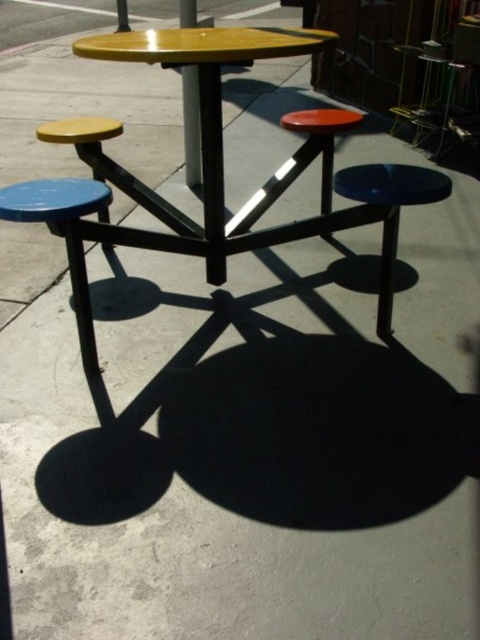
You are a person who is 1.6 meters tall and want to sit comfortably on either the blue matte stool at center or the shiny orange stool at center. Which stool would be more suitable for you based on their heights?

The blue matte stool at center is much taller than the shiny orange stool at center. Since you are 1.6 meters tall, the taller blue matte stool at center would provide a more comfortable seating height compared to the shorter shiny orange stool at center.

You are standing at the center of the table and want to place a blue matte stool exactly at the point marked as point (x=389, y=212). Is this point located on the table or outside of it?

The blue matte stool at center is represented by point (x=389, y=212), so the point is on the table.

You are designing a storage area and need to stack the blue painted metal stool at left and the blue matte stool at center vertically. Which stool should you place at the bottom to ensure stability?

The blue matte stool at center should be placed at the bottom because it is thicker than the blue painted metal stool at left, providing a more stable base.